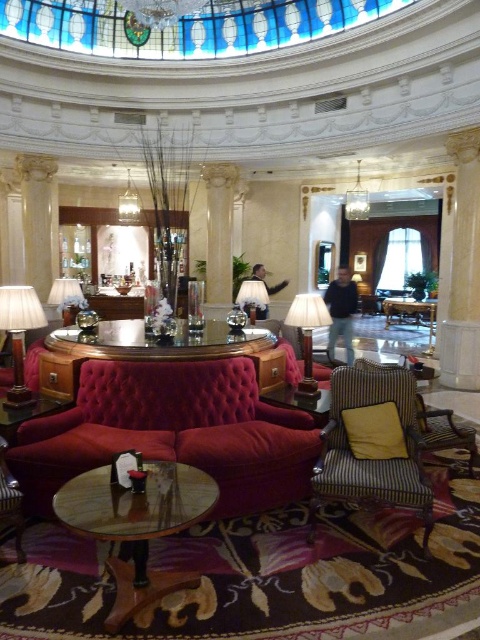
Which is behind, point (409, 396) or point (239, 296)?

Positioned behind is point (239, 296).

Can you confirm if striped fabric armchair at center is positioned to the left of matte silver lamp at center?

In fact, striped fabric armchair at center is to the right of matte silver lamp at center.

Image resolution: width=480 pixels, height=640 pixels. What do you see at coordinates (372, 444) in the screenshot?
I see `striped fabric armchair at center` at bounding box center [372, 444].

Identify the location of striped fabric armchair at center. [372, 444].

Is point (16, 465) closer to viewer compared to point (347, 189)?

Yes.

Is point (228, 400) in front of point (349, 212)?

That is True.

Find the location of a particular element. The height and width of the screenshot is (640, 480). velvet red couch at center is located at coordinates (171, 433).

Is matte orange lampshade at left to the left of matte beige lamp at center from the viewer's perspective?

Correct, you'll find matte orange lampshade at left to the left of matte beige lamp at center.

Is matte orange lampshade at left smaller than matte beige lamp at center?

Yes, matte orange lampshade at left is smaller than matte beige lamp at center.

Does point (14, 358) lie behind point (298, 307)?

No, it is not.

Where is `matte orange lampshade at left`? The height and width of the screenshot is (640, 480). matte orange lampshade at left is located at coordinates (20, 333).